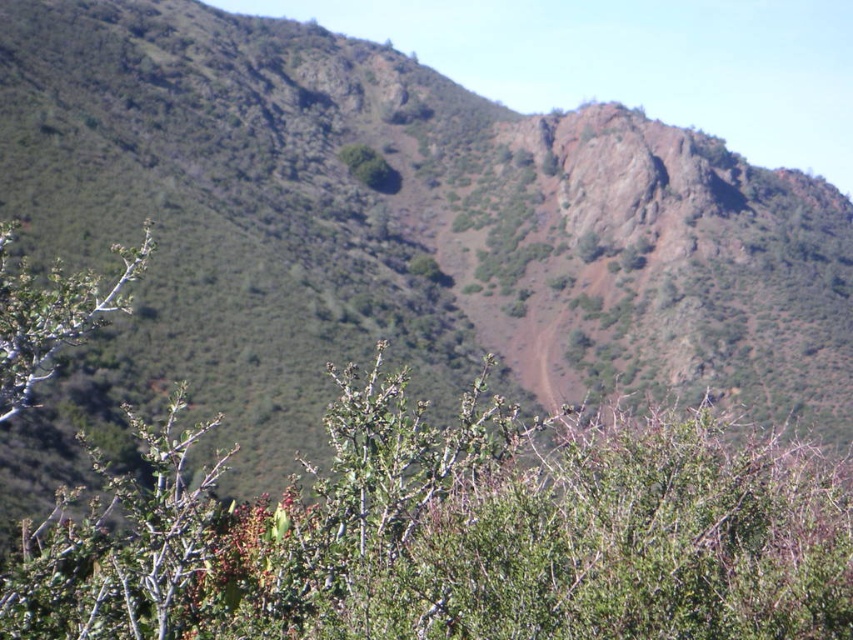
Does point (651, 548) come closer to viewer compared to point (56, 332)?

Yes, it is.

Does green leafy bush at center have a larger size compared to green leafy shrub at left?

No, green leafy bush at center is not bigger than green leafy shrub at left.

The width and height of the screenshot is (853, 640). Describe the element at coordinates (454, 536) in the screenshot. I see `green leafy bush at center` at that location.

In order to click on green leafy bush at center in this screenshot , I will do `click(454, 536)`.